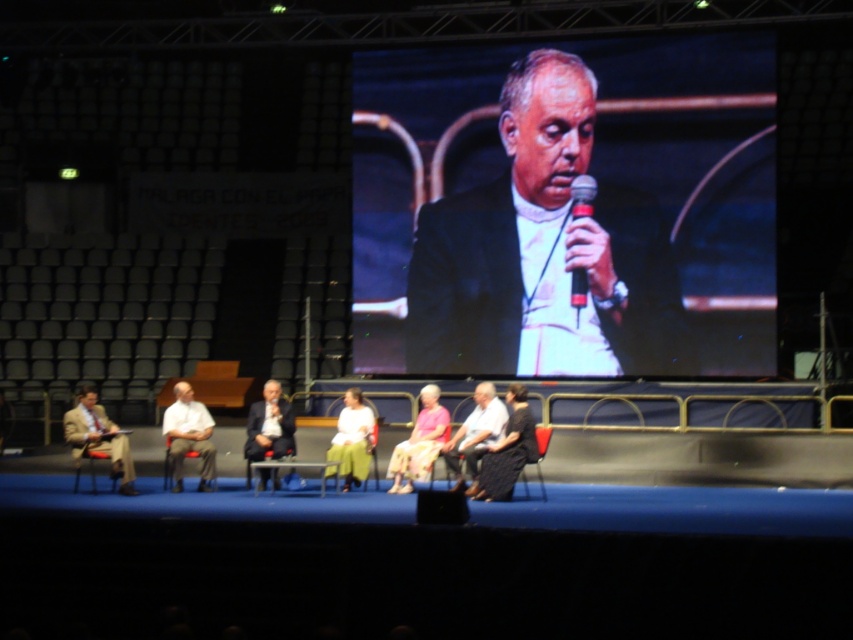
Question: Can you confirm if dark suit at center is wider than black plastic microphone at center?

Choices:
 (A) yes
 (B) no

Answer: (A)

Question: Which of the following is the closest to the observer?

Choices:
 (A) white fabric shirt at center
 (B) dark suit at center
 (C) pink fabric dress at center
 (D) light beige suit at left

Answer: (C)

Question: Which of the following is the farthest from the observer?

Choices:
 (A) black textured dress at lower center
 (B) light beige suit at left

Answer: (B)

Question: Is the position of white fabric shirt at center more distant than that of dark suit at center?

Choices:
 (A) no
 (B) yes

Answer: (B)

Question: Which object appears farthest from the camera in this image?

Choices:
 (A) dark suit at center
 (B) black plastic microphone at center

Answer: (B)

Question: Where is black textured dress at lower center located in relation to white fabric shirt at center in the image?

Choices:
 (A) right
 (B) left

Answer: (A)